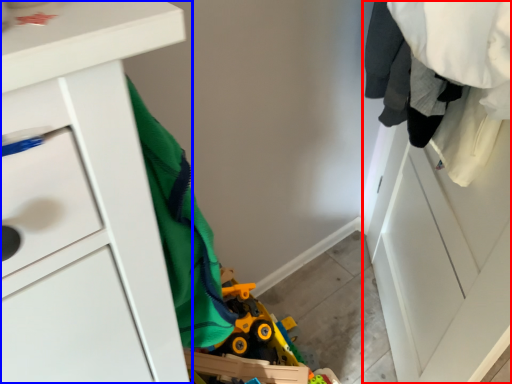
Question: Which object appears closest to the camera in this image, closet (highlighted by a red box) or chest of drawers (highlighted by a blue box)?

Choices:
 (A) closet
 (B) chest of drawers

Answer: (B)